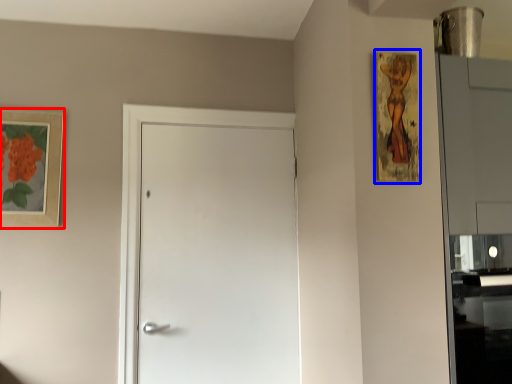
Question: Which point is closer to the camera, picture frame (highlighted by a red box) or picture frame (highlighted by a blue box)?

Choices:
 (A) picture frame
 (B) picture frame

Answer: (B)